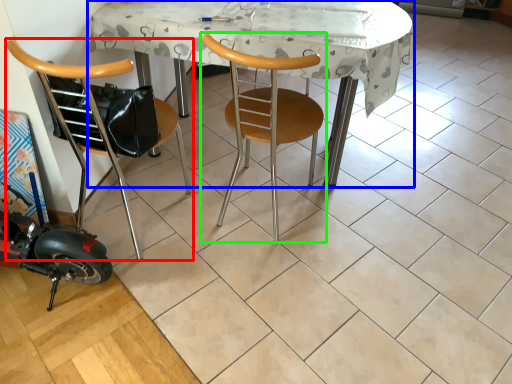
Question: Considering the real-world distances, which object is closest to chair (highlighted by a red box)? table (highlighted by a blue box) or chair (highlighted by a green box).

Choices:
 (A) table
 (B) chair

Answer: (B)